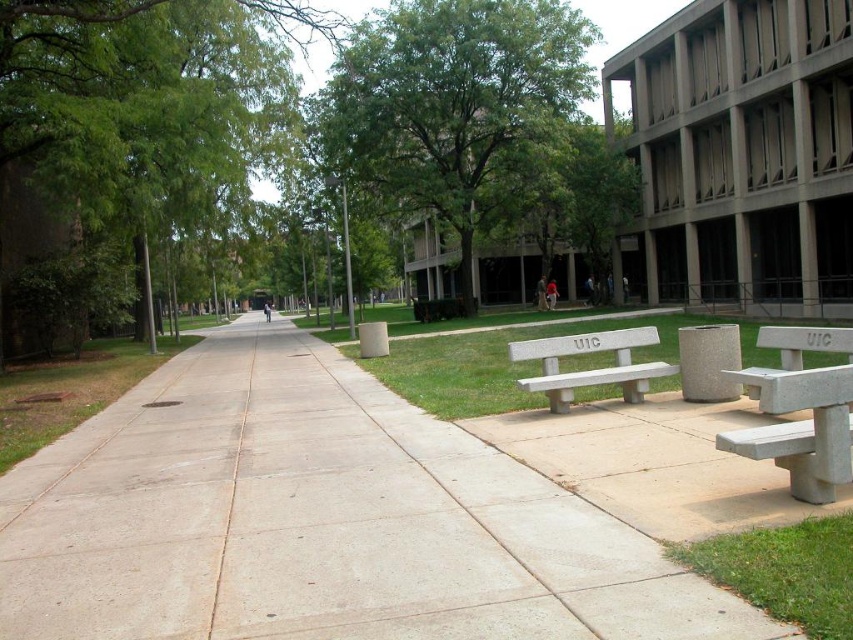
You are a student carrying a heavy backpack and need to sit down. You see the concrete at center and the green grass at lower right. Which surface would be more comfortable to sit on?

The green grass at lower right is more comfortable to sit on because it is softer than the concrete at center.